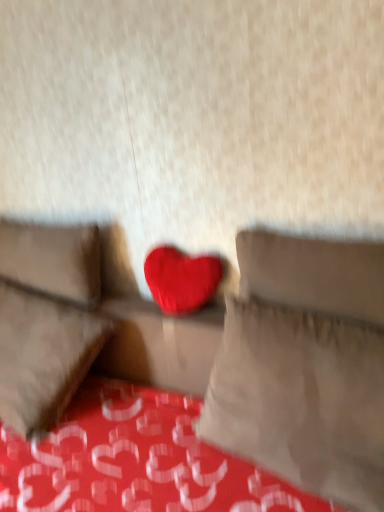
Question: Are matte fabric couch at center and suede-like beige pillow at left, placed as the 1th pillow when sorted from left to right, making contact?

Choices:
 (A) no
 (B) yes

Answer: (A)

Question: From a real-world perspective, is matte fabric couch at center physically below suede-like beige pillow at left, placed as the 1th pillow when sorted from left to right?

Choices:
 (A) yes
 (B) no

Answer: (A)

Question: From the image's perspective, is matte fabric couch at center located beneath suede-like beige pillow at left, which appears as the 1th pillow when viewed from the back?

Choices:
 (A) no
 (B) yes

Answer: (B)

Question: Is matte fabric couch at center at the left side of suede-like beige pillow at left, which appears as the 2th pillow when viewed from the front?

Choices:
 (A) yes
 (B) no

Answer: (B)

Question: Would you say matte fabric couch at center is a long distance from suede-like beige pillow at left, which appears as the 2th pillow when viewed from the front?

Choices:
 (A) no
 (B) yes

Answer: (A)

Question: In terms of width, does suede-like beige pillow at left, arranged as the 2th pillow when viewed from the right, look wider or thinner when compared to matte red heart at center?

Choices:
 (A) thin
 (B) wide

Answer: (B)

Question: Is point (56, 294) positioned closer to the camera than point (190, 272)?

Choices:
 (A) farther
 (B) closer

Answer: (A)

Question: From the image's perspective, relative to matte red heart at center, is suede-like beige pillow at left, which appears as the 2th pillow when viewed from the front, above or below?

Choices:
 (A) below
 (B) above

Answer: (B)

Question: From a real-world perspective, is suede-like beige pillow at left, placed as the 1th pillow when sorted from left to right, physically located above or below matte red heart at center?

Choices:
 (A) below
 (B) above

Answer: (B)

Question: Does point (344, 479) appear closer or farther from the camera than point (66, 243)?

Choices:
 (A) closer
 (B) farther

Answer: (A)

Question: Looking at their shapes, would you say matte fabric heart at center, placed as the second pillow when sorted from left to right, is wider or thinner than suede-like beige pillow at left, which appears as the 2th pillow when viewed from the front?

Choices:
 (A) wide
 (B) thin

Answer: (A)

Question: From a real-world perspective, is matte fabric heart at center, which is the first pillow from front to back, positioned above or below suede-like beige pillow at left, placed as the 1th pillow when sorted from left to right?

Choices:
 (A) below
 (B) above

Answer: (A)

Question: Is matte fabric heart at center, placed as the second pillow when sorted from left to right, in front of or behind suede-like beige pillow at left, which appears as the 1th pillow when viewed from the back, in the image?

Choices:
 (A) front
 (B) behind

Answer: (A)

Question: In the image, is matte fabric couch at center positioned in front of or behind suede-like beige pillow at left, which appears as the 1th pillow when viewed from the back?

Choices:
 (A) front
 (B) behind

Answer: (A)

Question: Is matte fabric couch at center situated inside suede-like beige pillow at left, which appears as the 2th pillow when viewed from the front, or outside?

Choices:
 (A) inside
 (B) outside

Answer: (B)